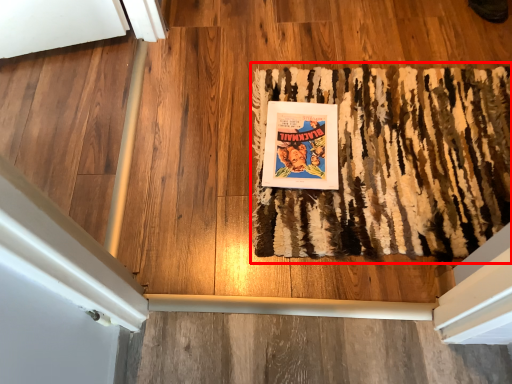
Question: Where is mat (annotated by the red box) located in relation to paperback book in the image?

Choices:
 (A) left
 (B) right

Answer: (B)